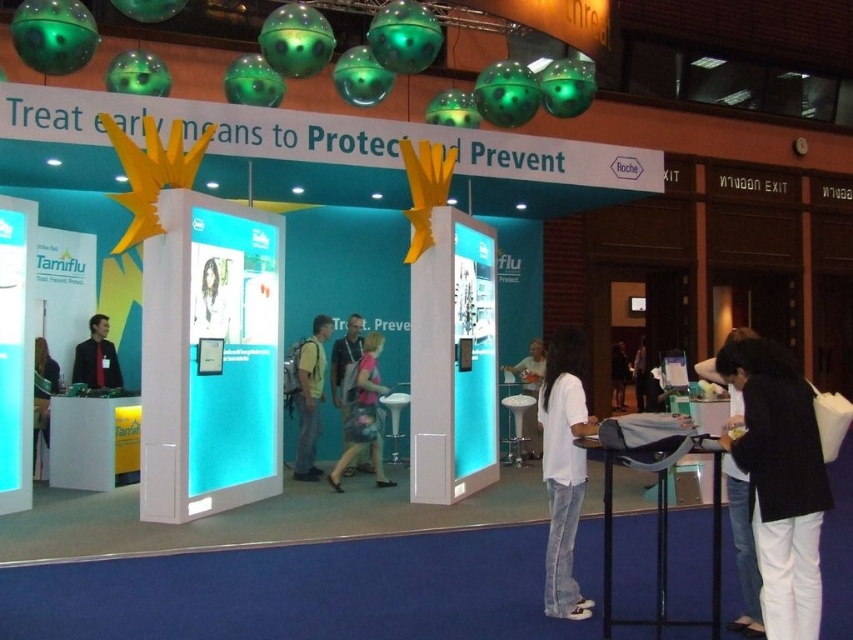
Does point (527, 416) lie behind point (42, 410)?

Yes, it is behind point (42, 410).

Does matte white shirt at center have a smaller size compared to matte black jacket at center?

Incorrect, matte white shirt at center is not smaller in size than matte black jacket at center.

Where is `matte white shirt at center`? This screenshot has width=853, height=640. matte white shirt at center is located at coordinates (529, 369).

Measure the distance from white matte shirt at lower right to light blue fabric backpack at center.

5.24 meters

Which is in front, point (740, 512) or point (306, 460)?

Point (740, 512) is more forward.

Which is behind, point (724, 344) or point (312, 340)?

The point (724, 344) is behind.

Where is `white matte shirt at lower right`? Image resolution: width=853 pixels, height=640 pixels. white matte shirt at lower right is located at coordinates (743, 548).

You are a GUI agent. You are given a task and a screenshot of the screen. Output one action in this format:
    pyautogui.click(x=<x>, y=<y>)
    Task: Click on the white matte pants at lower right
    
    Given the screenshot: What is the action you would take?
    pyautogui.click(x=780, y=481)

How distant is white matte pants at lower right from light blue fabric backpack at center?

white matte pants at lower right is 5.50 meters from light blue fabric backpack at center.

Is point (822, 499) positioned before point (317, 340)?

Yes, point (822, 499) is in front of point (317, 340).

The image size is (853, 640). Identify the location of white matte pants at lower right. (780, 481).